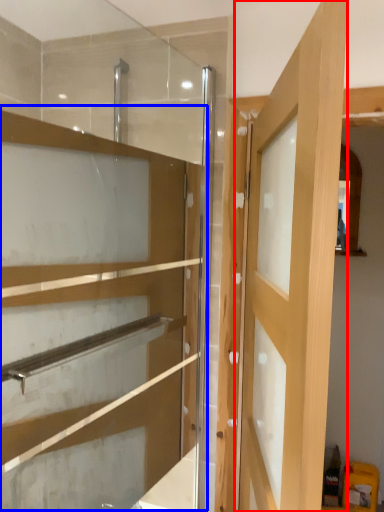
Question: Which point is further to the camera, door (highlighted by a red box) or cabinetry (highlighted by a blue box)?

Choices:
 (A) door
 (B) cabinetry

Answer: (B)